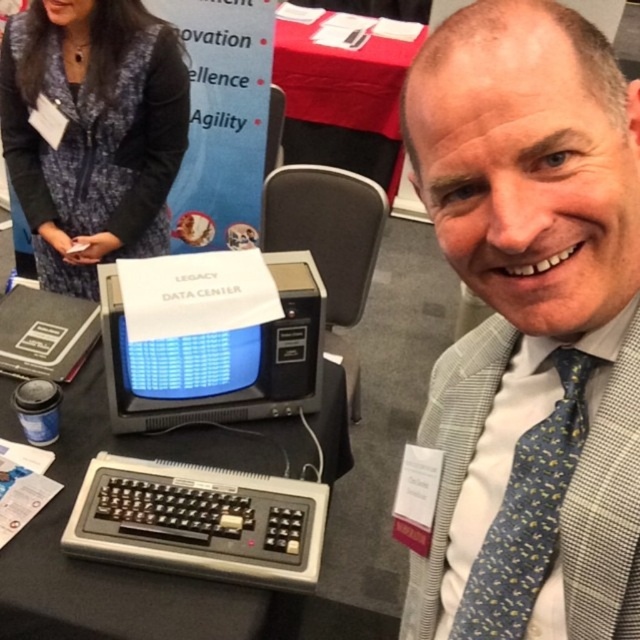
Does gray checkered suit at center have a greater height compared to blue dotted silk tie at right?

Correct, gray checkered suit at center is much taller as blue dotted silk tie at right.

Is gray checkered suit at center smaller than blue dotted silk tie at right?

No, gray checkered suit at center is not smaller than blue dotted silk tie at right.

The width and height of the screenshot is (640, 640). Find the location of `gray checkered suit at center`. gray checkered suit at center is located at coordinates (531, 326).

I want to click on gray checkered suit at center, so click(531, 326).

Between blue textured sweater at upper left and blue dotted silk tie at right, which one is positioned higher?

Positioned higher is blue textured sweater at upper left.

Which is behind, point (128, 179) or point (548, 524)?

The point (128, 179) is more distant.

Who is more distant from viewer, (90, 52) or (460, 604)?

Positioned behind is point (90, 52).

Where is `blue textured sweater at upper left`? blue textured sweater at upper left is located at coordinates (93, 132).

Does black plastic keyboard at lower left have a smaller size compared to black plastic crt monitor at center?

No, black plastic keyboard at lower left is not smaller than black plastic crt monitor at center.

Can you confirm if black plastic keyboard at lower left is taller than black plastic crt monitor at center?

Indeed, black plastic keyboard at lower left has a greater height compared to black plastic crt monitor at center.

This screenshot has width=640, height=640. I want to click on black plastic keyboard at lower left, so click(140, 568).

At what (x,y) coordinates should I click in order to perform the action: click on black plastic keyboard at lower left. Please return your answer as a coordinate pair (x, y). Looking at the image, I should click on point(140,568).